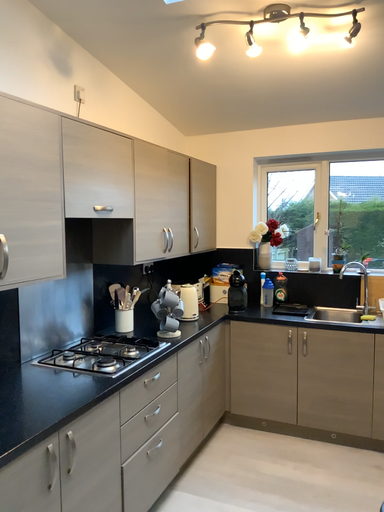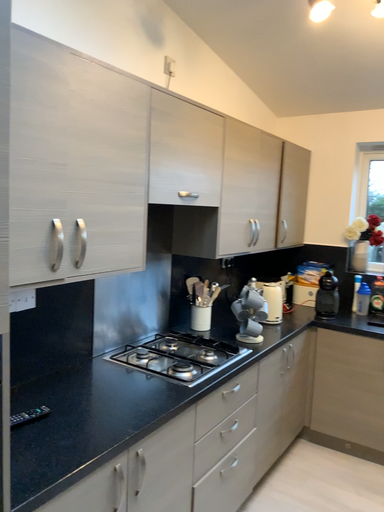
Question: Which way did the camera rotate in the video?

Choices:
 (A) rotated right
 (B) rotated left

Answer: (B)